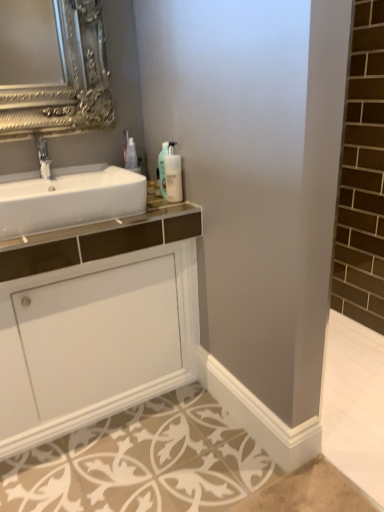
Where is `free space in front of white painted wood baseboard at lower center`? Image resolution: width=384 pixels, height=512 pixels. free space in front of white painted wood baseboard at lower center is located at coordinates (238, 471).